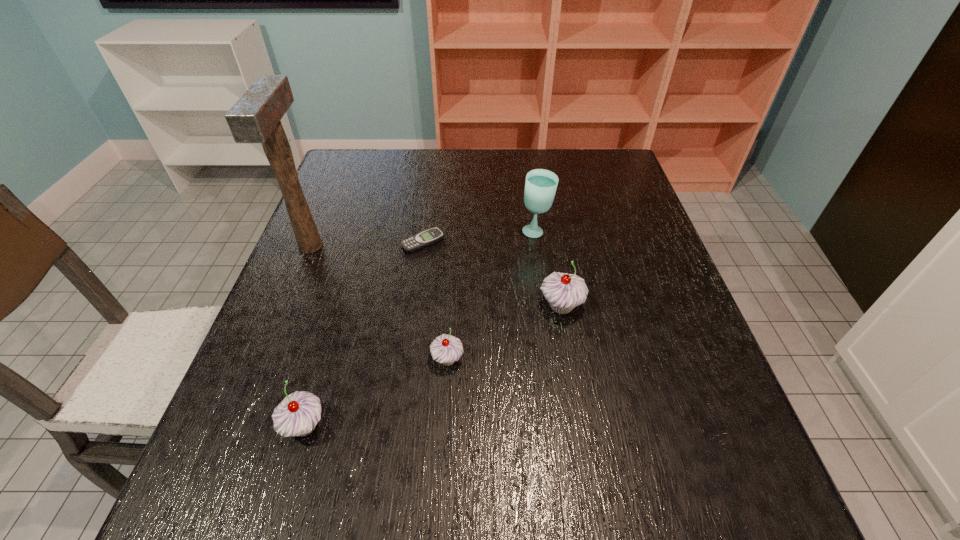
Where is `free spot between the second object from left to right and the second nearest cupcake`? free spot between the second object from left to right and the second nearest cupcake is located at coordinates (376, 393).

Find the location of a particular element. The image size is (960, 540). free space between the second tallest cupcake and the mallet is located at coordinates (307, 336).

Locate an element on the screen. The width and height of the screenshot is (960, 540). empty location between the fifth object from right to left and the mallet is located at coordinates (307, 336).

Where is `vacant space that's between the tallest object and the leftmost cupcake`? vacant space that's between the tallest object and the leftmost cupcake is located at coordinates (307, 336).

I want to click on vacant space in between the tallest object and the shortest object, so click(367, 244).

Where is `vacant area between the second cupcake from left to right and the shortest object`? vacant area between the second cupcake from left to right and the shortest object is located at coordinates (435, 301).

At what (x,y) coordinates should I click in order to perform the action: click on object that stands as the third closest to the shortest object. Please return your answer as a coordinate pair (x, y). The width and height of the screenshot is (960, 540). Looking at the image, I should click on (563, 291).

Where is `object that stands as the closest to the shortest cupcake`? The width and height of the screenshot is (960, 540). object that stands as the closest to the shortest cupcake is located at coordinates (563, 291).

Identify which cupcake is located as the nearest to the glass. Please provide its 2D coordinates. Your answer should be formatted as a tuple, i.e. [(x, y)], where the tuple contains the x and y coordinates of a point satisfying the conditions above.

[(563, 291)]

Choose which cupcake is the second nearest neighbor to the second shortest object. Please provide its 2D coordinates. Your answer should be formatted as a tuple, i.e. [(x, y)], where the tuple contains the x and y coordinates of a point satisfying the conditions above.

[(297, 415)]